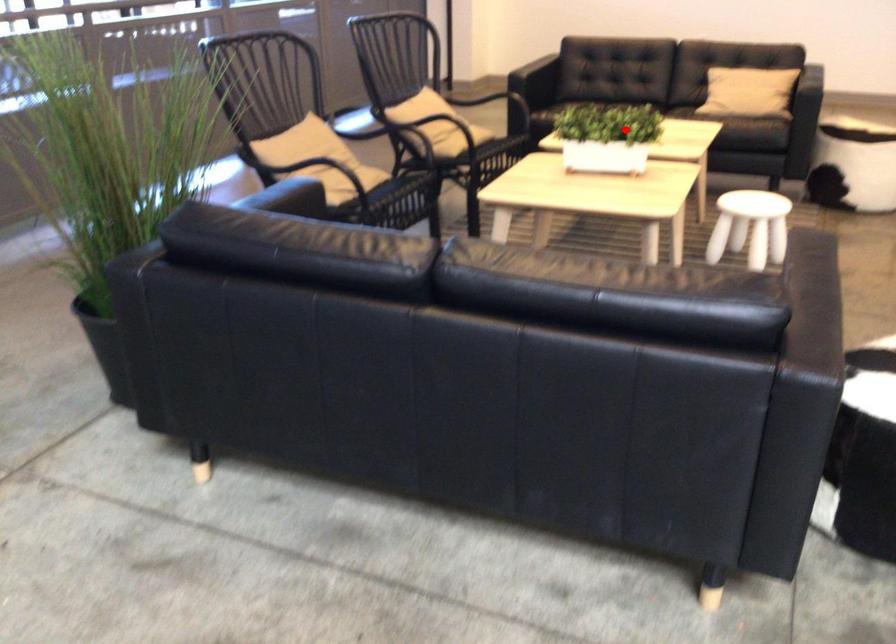
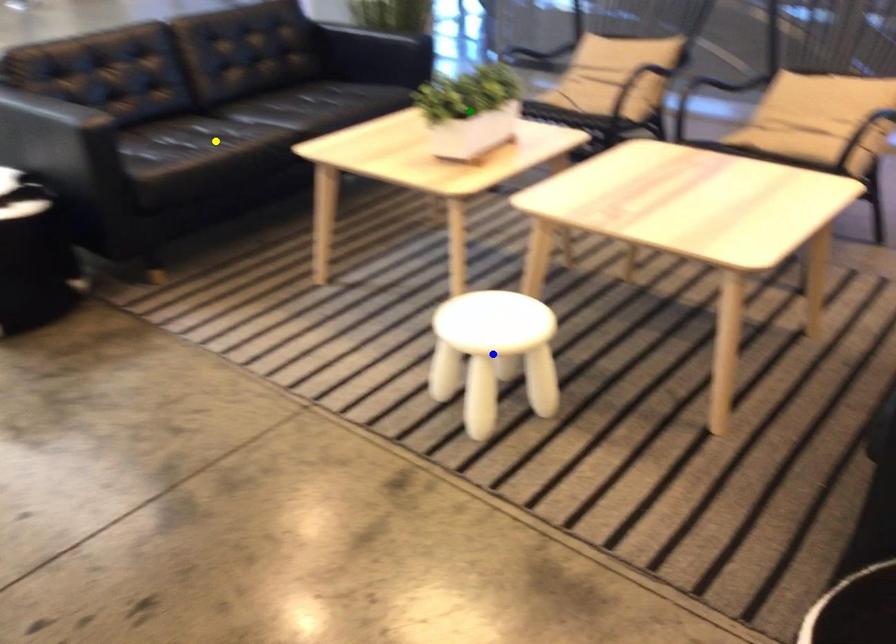
Question: I am providing you with two images of the same scene from different viewpoints. A red point is marked on the first image. You are given multiple points on the second image. Which mark in image 2 goes with the point in image 1?

Choices:
 (A) yellow point
 (B) blue point
 (C) green point

Answer: (C)